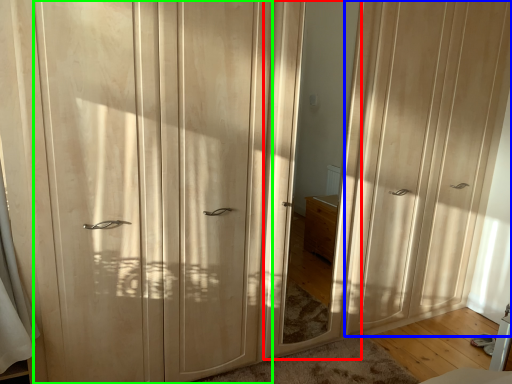
Question: Which object is positioned farthest from mirror (highlighted by a red box)? Select from screen door (highlighted by a blue box) and screen door (highlighted by a green box).

Choices:
 (A) screen door
 (B) screen door

Answer: (B)